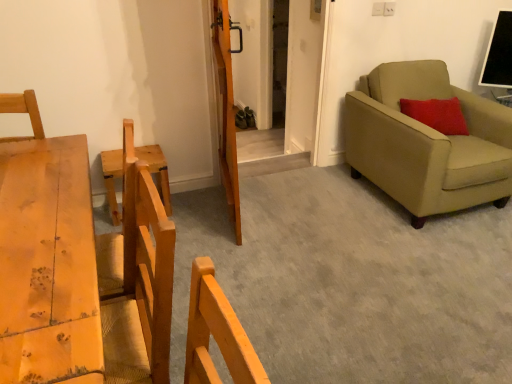
You are a GUI agent. You are given a task and a screenshot of the screen. Output one action in this format:
    pyautogui.click(x=<x>, y=<y>)
    Task: Click on the free point behind wooden door at center
    
    Given the screenshot: What is the action you would take?
    pyautogui.click(x=249, y=183)